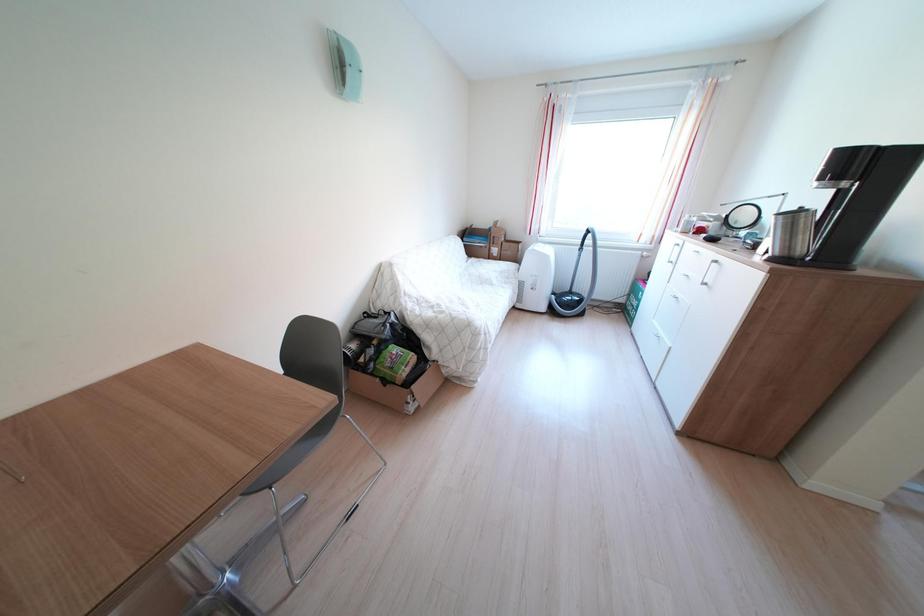
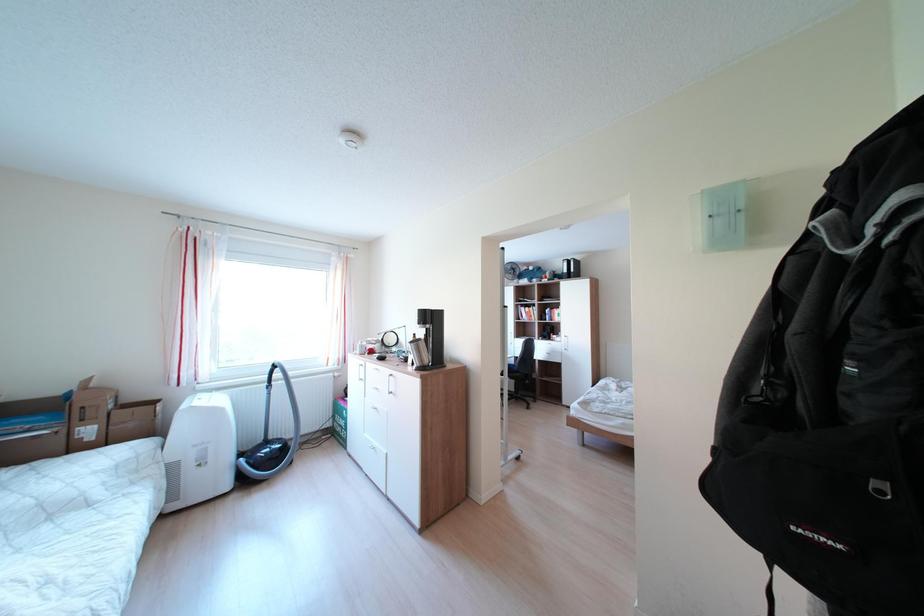
Question: The camera is either moving clockwise (left) or counter-clockwise (right) around the object. The first image is from the beginning of the video and the second image is from the end. Is the camera moving left or right when shooting the video?

Choices:
 (A) Left
 (B) Right

Answer: (A)